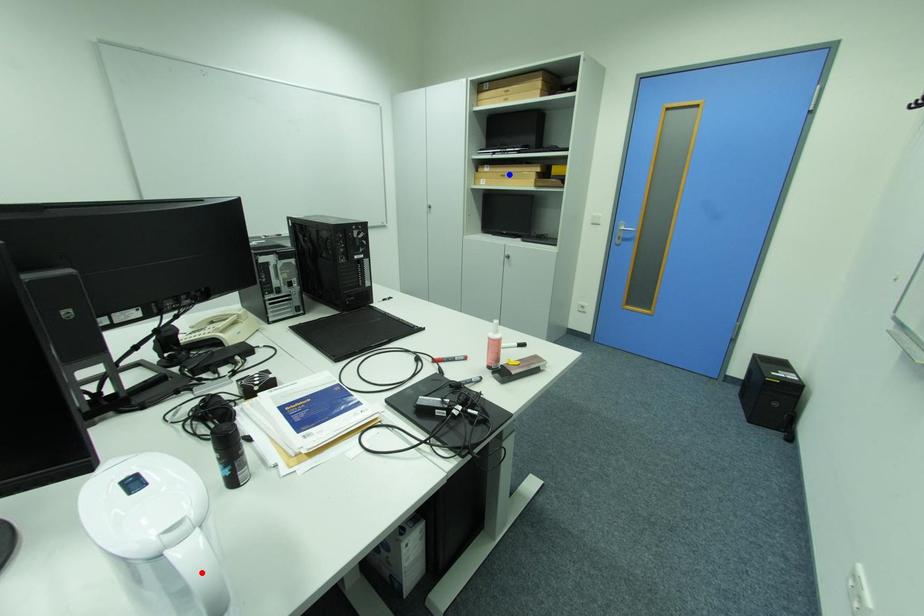
Question: Which of the two points in the image is closer to the camera?

Choices:
 (A) Blue point is closer.
 (B) Red point is closer.

Answer: (B)